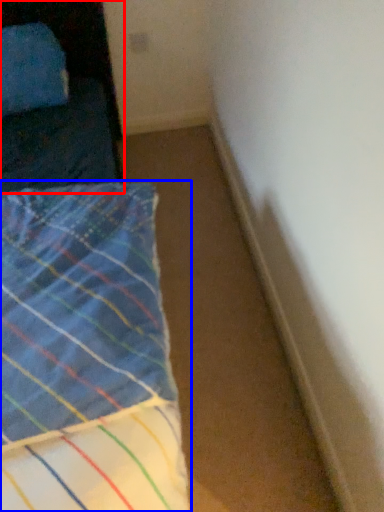
Question: Which object is further to the camera taking this photo, furniture (highlighted by a red box) or bed (highlighted by a blue box)?

Choices:
 (A) furniture
 (B) bed

Answer: (A)